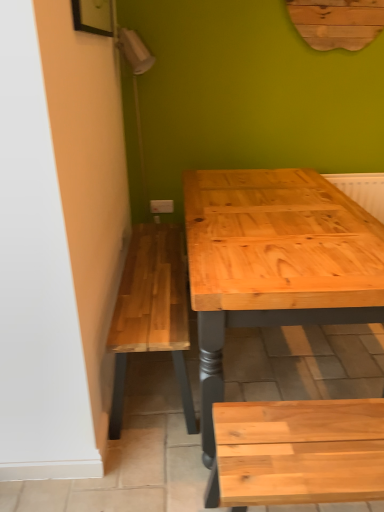
Question: Looking at the image, does white plastic electric outlet at center seem bigger or smaller compared to natural wood bench at lower right?

Choices:
 (A) small
 (B) big

Answer: (A)

Question: Do you think white plastic electric outlet at center is within natural wood bench at lower right, or outside of it?

Choices:
 (A) inside
 (B) outside

Answer: (B)

Question: Is white plastic electric outlet at center to the left or to the right of natural wood bench at lower right in the image?

Choices:
 (A) right
 (B) left

Answer: (B)

Question: Which is correct: natural wood bench at lower right is inside white plastic electric outlet at center, or outside of it?

Choices:
 (A) outside
 (B) inside

Answer: (A)

Question: From a real-world perspective, relative to white plastic electric outlet at center, is natural wood bench at lower right vertically above or below?

Choices:
 (A) above
 (B) below

Answer: (B)

Question: Is natural wood bench at lower right bigger or smaller than white plastic electric outlet at center?

Choices:
 (A) big
 (B) small

Answer: (A)

Question: Does point (352, 450) appear closer or farther from the camera than point (160, 205)?

Choices:
 (A) closer
 (B) farther

Answer: (A)